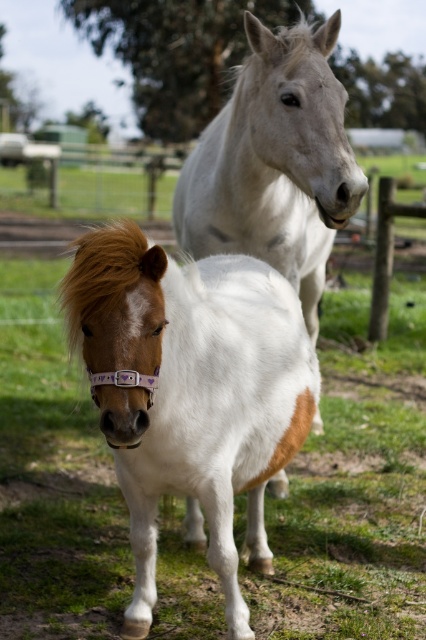
You are a farmer checking the paddock. You see the white glossy pony at center and the white glossy horse at upper center. Which one is closer to the ground?

The white glossy pony at center is closer to the ground because it is positioned below the white glossy horse at upper center.

You are standing in the paddock and want to walk to the point that is closer to you. Which point should you head towards, point [109,305] or point [219,186]?

You should head towards point [109,305] because it is closer to the viewer than point [219,186].

You are a farmer who needs to determine which animal is more suitable for a child to ride. Based on the image, which of the two animals, the white glossy pony at center or the white glossy horse at upper center, is smaller in size?

The white glossy pony at center is smaller in size compared to the white glossy horse at upper center, making it more suitable for a child to ride.